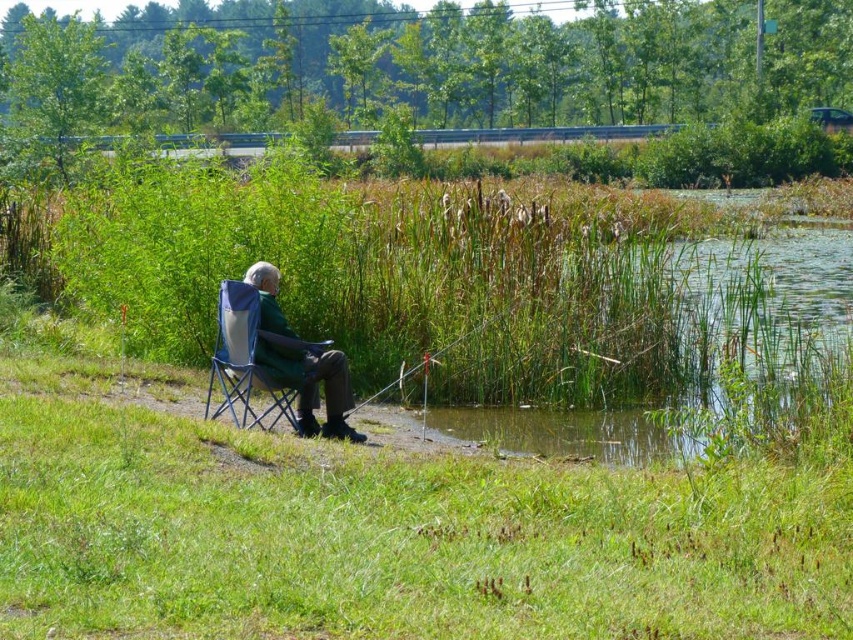
You are standing at the edge of the water in the scene. There is a green fabric chair at center marked by point (300,362). If you want to walk directly to the chair, which direction should you head?

The green fabric chair at center is located at point (300,362), so you should head towards the center of the scene to reach it.

You are standing at the camera position and want to know how far you are from the point marked as point (350, 428) in the image. Can you determine the distance?

The point (350, 428) is 35.54 feet away from the camera position.

You are standing at the edge of the water and want to move closer to the green fabric folding chair at center. However, there is a green fabric chair at center in the way. Can you walk around it to reach the folding chair?

The green fabric folding chair at center is behind the green fabric chair at center, so you can walk around the green fabric chair at center to reach the folding chair.